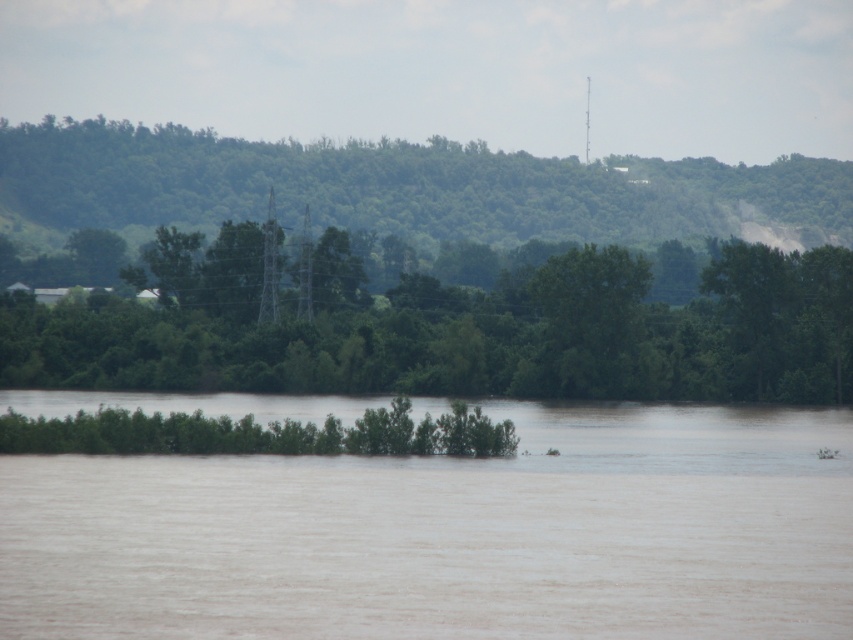
Is point (550, 432) positioned before point (782, 401)?

That is True.

From the picture: Is brown muddy water at center shorter than green leafy tree at center?

Yes.

Does point (210, 636) come closer to viewer compared to point (221, 340)?

Yes, point (210, 636) is in front of point (221, 340).

Where is `brown muddy water at center`? brown muddy water at center is located at coordinates click(x=450, y=534).